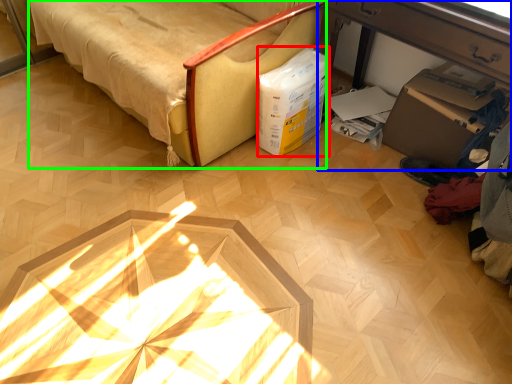
Question: Considering the real-world distances, which object is farthest from box (highlighted by a red box)? table (highlighted by a blue box) or furniture (highlighted by a green box)?

Choices:
 (A) table
 (B) furniture

Answer: (B)